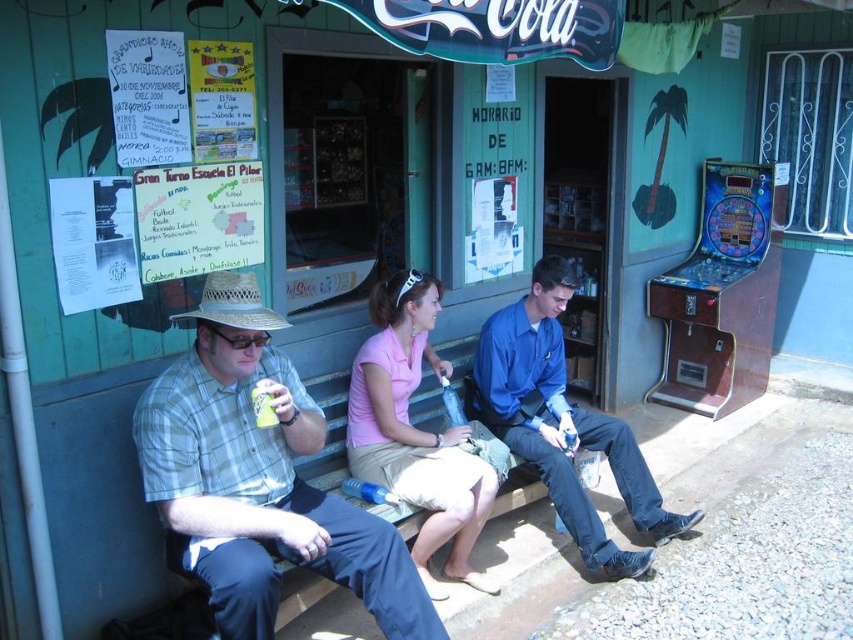
You are standing at the point with coordinates point [260,384] and want to walk to the point with coordinates point [711,241]. Which direction should you move?

Since point [711,241] is behind point [260,384], you should move backward to reach it.

You are planning to place the green matte can at center onto the wooden cabinet at right. Based on the scene description, will the can fit on the cabinet?

The wooden cabinet at right is wider than the green matte can at center, so the can will fit on the cabinet.

You are a photographer trying to capture a photo of the pink fabric shirt at center and the green matte can at center. Which object should you focus on first if you want to ensure both are in focus, given that your camera can only focus on one object at a time?

The pink fabric shirt at center is taller than the green matte can at center, so you should focus on the pink fabric shirt at center first to ensure both are in focus.